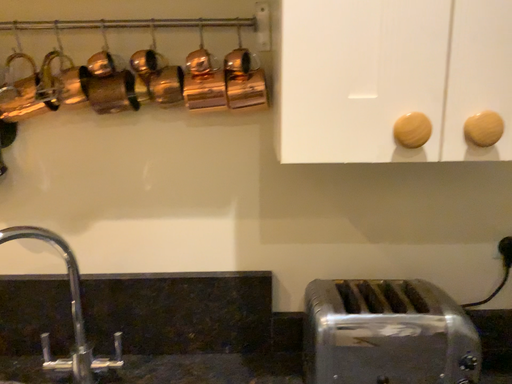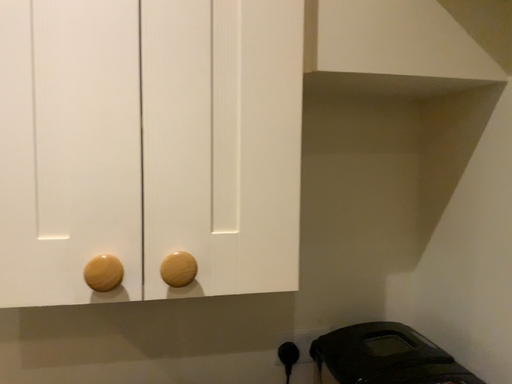
Question: How did the camera likely rotate when shooting the video?

Choices:
 (A) rotated right
 (B) rotated left

Answer: (A)